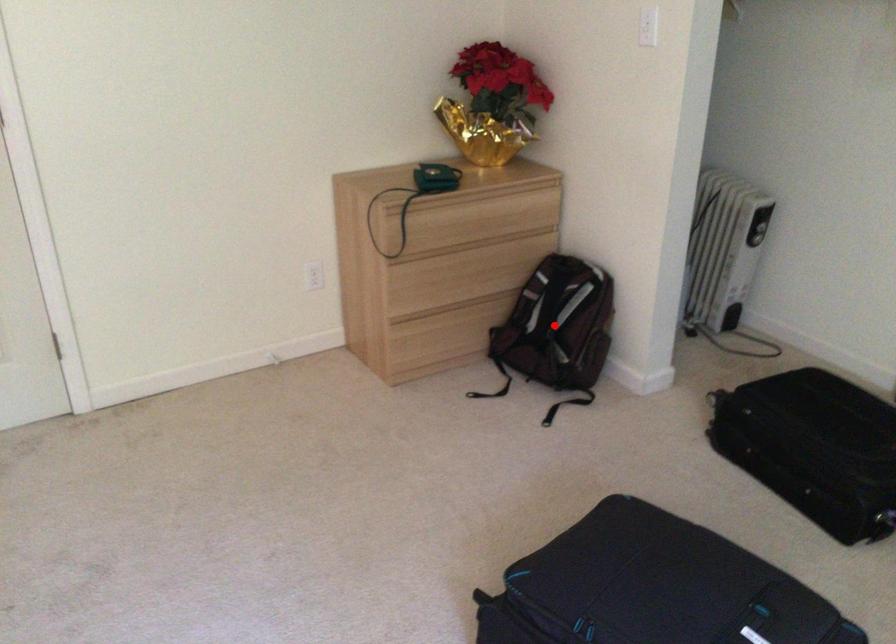
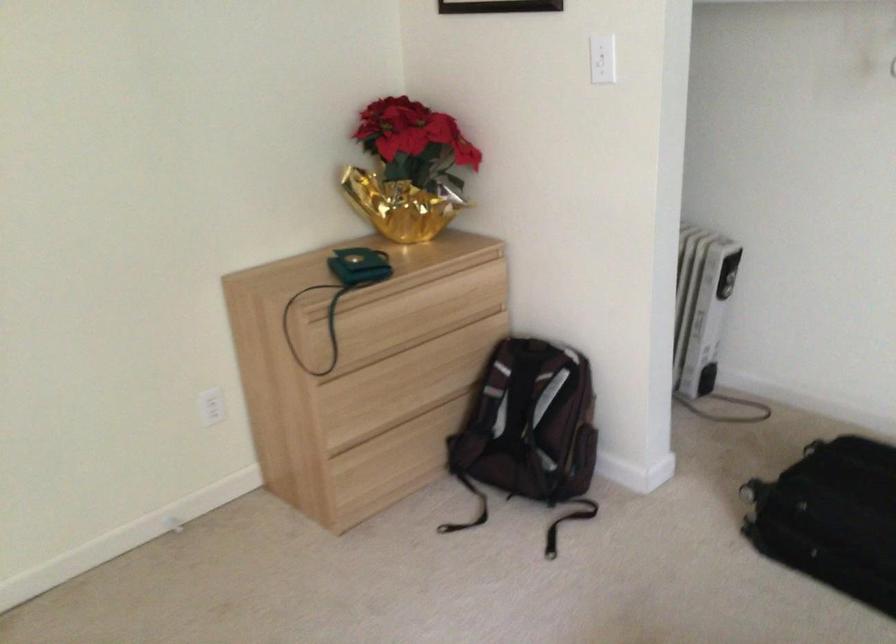
Question: I am providing you with two images of the same scene from different viewpoints. In image1, a red point is highlighted. Considering the same 3D point in image2, which of the following is correct?

Choices:
 (A) It is closer
 (B) It is farther

Answer: (A)